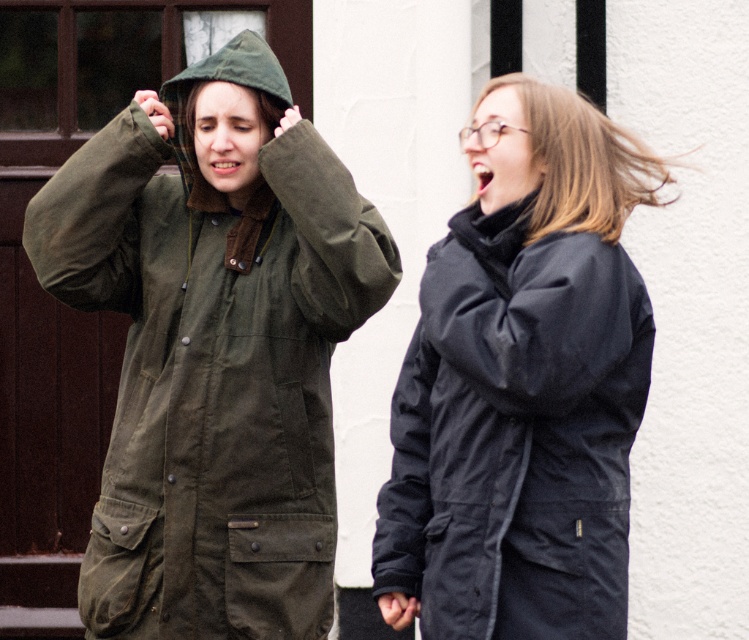
Question: Considering the relative positions of olive green waxed canvas trench coat at left and matte black coat at right in the image provided, where is olive green waxed canvas trench coat at left located with respect to matte black coat at right?

Choices:
 (A) left
 (B) right

Answer: (A)

Question: Is olive green waxed canvas trench coat at left behind matte black coat at right?

Choices:
 (A) no
 (B) yes

Answer: (B)

Question: Among these objects, which one is farthest from the camera?

Choices:
 (A) matte black coat at right
 (B) olive green waxed canvas trench coat at left

Answer: (B)

Question: Where is olive green waxed canvas trench coat at left located in relation to matte black coat at right in the image?

Choices:
 (A) left
 (B) right

Answer: (A)